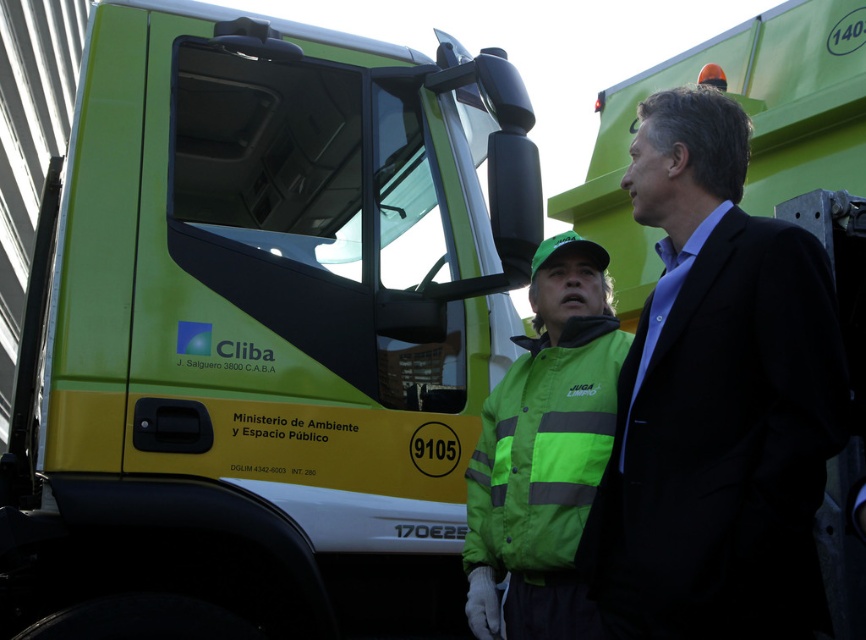
Question: Which point is farther to the camera?

Choices:
 (A) (805, 605)
 (B) (309, 493)
 (C) (503, 378)

Answer: (C)

Question: Estimate the real-world distances between objects in this image. Which object is closer to the green matte truck at center?

Choices:
 (A) green reflective safety vest at center
 (B) black matte suit at center

Answer: (A)

Question: Among these points, which one is nearest to the camera?

Choices:
 (A) (551, 563)
 (B) (828, 337)
 (C) (227, 90)

Answer: (B)

Question: Can you confirm if black matte suit at center is thinner than green reflective safety vest at center?

Choices:
 (A) yes
 (B) no

Answer: (B)

Question: Does black matte suit at center have a larger size compared to green reflective safety vest at center?

Choices:
 (A) no
 (B) yes

Answer: (B)

Question: Is green matte truck at center bigger than green reflective safety vest at center?

Choices:
 (A) no
 (B) yes

Answer: (B)